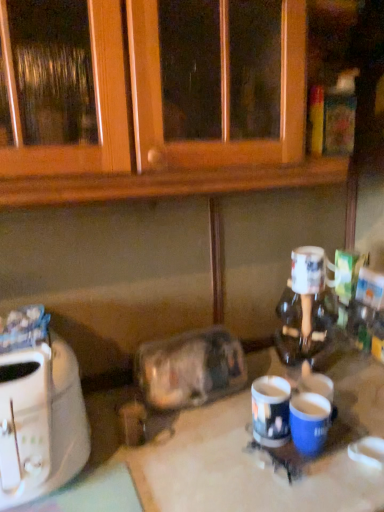
Question: Is white glossy mug at right, which appears as the first coffee cup when viewed from the top, positioned in front of white plastic toaster at left?

Choices:
 (A) no
 (B) yes

Answer: (A)

Question: Is white glossy mug at right, which appears as the first coffee cup when viewed from the top, outside of white plastic toaster at left?

Choices:
 (A) yes
 (B) no

Answer: (A)

Question: Is white glossy mug at right, which appears as the first coffee cup when viewed from the top, wider than white plastic toaster at left?

Choices:
 (A) no
 (B) yes

Answer: (A)

Question: Is white glossy mug at right, positioned as the third coffee cup in bottom-to-top order, looking in the opposite direction of white plastic toaster at left?

Choices:
 (A) no
 (B) yes

Answer: (A)

Question: From the image's perspective, is white glossy mug at right, positioned as the third coffee cup in bottom-to-top order, on top of white plastic toaster at left?

Choices:
 (A) yes
 (B) no

Answer: (A)

Question: Is blue matte mug at lower center, the 1th coffee cup from the bottom, inside or outside of blue glossy mug at center, positioned as the second coffee cup in bottom-to-top order?

Choices:
 (A) outside
 (B) inside

Answer: (A)

Question: From the image's perspective, is blue matte mug at lower center, the 1th coffee cup from the bottom, positioned above or below blue glossy mug at center, the 2th coffee cup when ordered from top to bottom?

Choices:
 (A) below
 (B) above

Answer: (A)

Question: Is blue matte mug at lower center, which is the 3th coffee cup from top to bottom, wider or thinner than blue glossy mug at center, the 2th coffee cup when ordered from top to bottom?

Choices:
 (A) wide
 (B) thin

Answer: (A)

Question: Is point (327, 401) positioned closer to the camera than point (251, 390)?

Choices:
 (A) farther
 (B) closer

Answer: (B)

Question: Considering their positions, is white glossy table at center located in front of or behind blue glossy mug at center, the 2th coffee cup when ordered from top to bottom?

Choices:
 (A) behind
 (B) front

Answer: (B)

Question: Looking at their shapes, would you say white glossy table at center is wider or thinner than blue glossy mug at center, positioned as the second coffee cup in bottom-to-top order?

Choices:
 (A) wide
 (B) thin

Answer: (A)

Question: Looking at the image, does white glossy table at center seem bigger or smaller compared to blue glossy mug at center, the 2th coffee cup when ordered from top to bottom?

Choices:
 (A) big
 (B) small

Answer: (A)

Question: Based on their positions, is white glossy table at center located to the left or right of blue glossy mug at center, positioned as the second coffee cup in bottom-to-top order?

Choices:
 (A) left
 (B) right

Answer: (A)

Question: Would you say transparent plastic container at center is to the left or to the right of white glossy mug at right, which appears as the first coffee cup when viewed from the top, in the picture?

Choices:
 (A) left
 (B) right

Answer: (A)

Question: Do you think transparent plastic container at center is within white glossy mug at right, positioned as the third coffee cup in bottom-to-top order, or outside of it?

Choices:
 (A) inside
 (B) outside

Answer: (B)